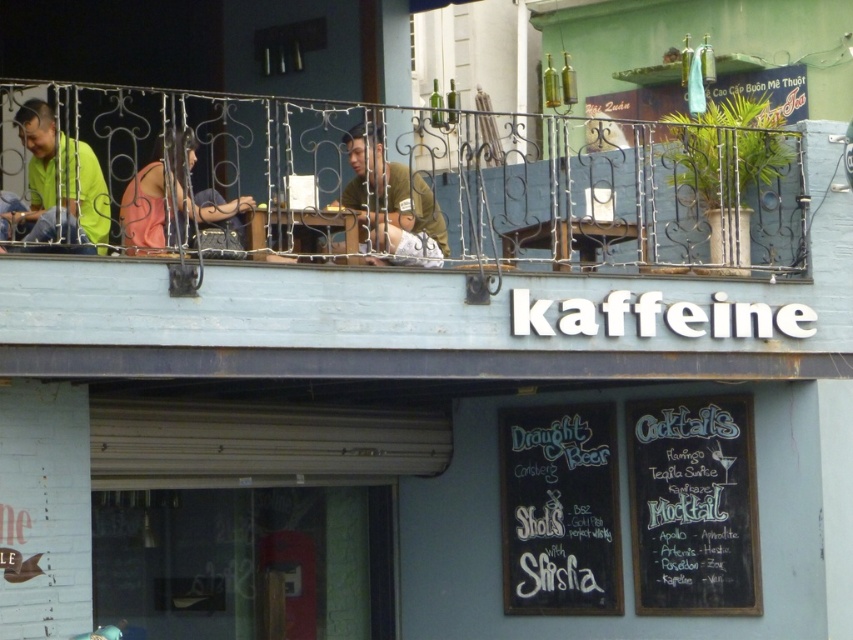
This screenshot has height=640, width=853. What do you see at coordinates (392, 204) in the screenshot?
I see `green matte shirt at center` at bounding box center [392, 204].

Does green matte shirt at center appear over pink fabric at center?

Indeed, green matte shirt at center is positioned over pink fabric at center.

Identify the location of green matte shirt at center. (392, 204).

In order to click on green matte shirt at center in this screenshot , I will do `click(392, 204)`.

Does white chalkboard at lower center appear under matte green shirt at left?

Yes.

Does point (590, 433) come closer to viewer compared to point (76, 160)?

No, it is behind (76, 160).

Locate an element on the screen. white chalkboard at lower center is located at coordinates (560, 509).

Who is more forward, (73, 180) or (184, 132)?

Answer: Point (73, 180) is in front.

Is matte green shirt at left above pink fabric at center?

Indeed, matte green shirt at left is positioned over pink fabric at center.

Is point (22, 109) positioned behind point (187, 195)?

Yes.

Locate an element on the screen. This screenshot has height=640, width=853. matte green shirt at left is located at coordinates (56, 189).